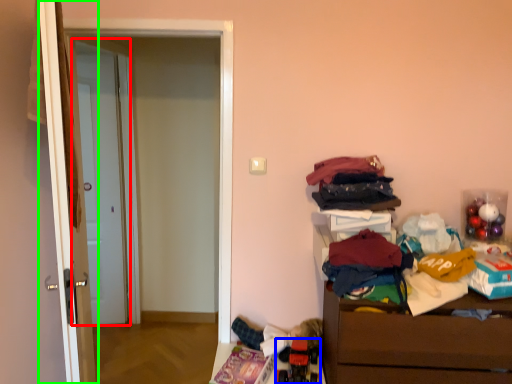
Question: Considering the real-world distances, which object is closest to door (highlighted by a red box)? toy (highlighted by a blue box) or door (highlighted by a green box).

Choices:
 (A) toy
 (B) door

Answer: (B)